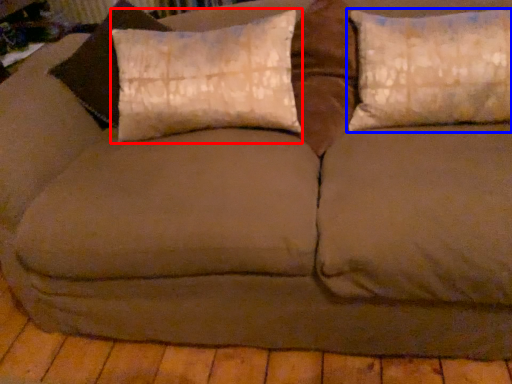
Question: Which of the following is the closest to the observer, pillow (highlighted by a red box) or pillow (highlighted by a blue box)?

Choices:
 (A) pillow
 (B) pillow

Answer: (B)